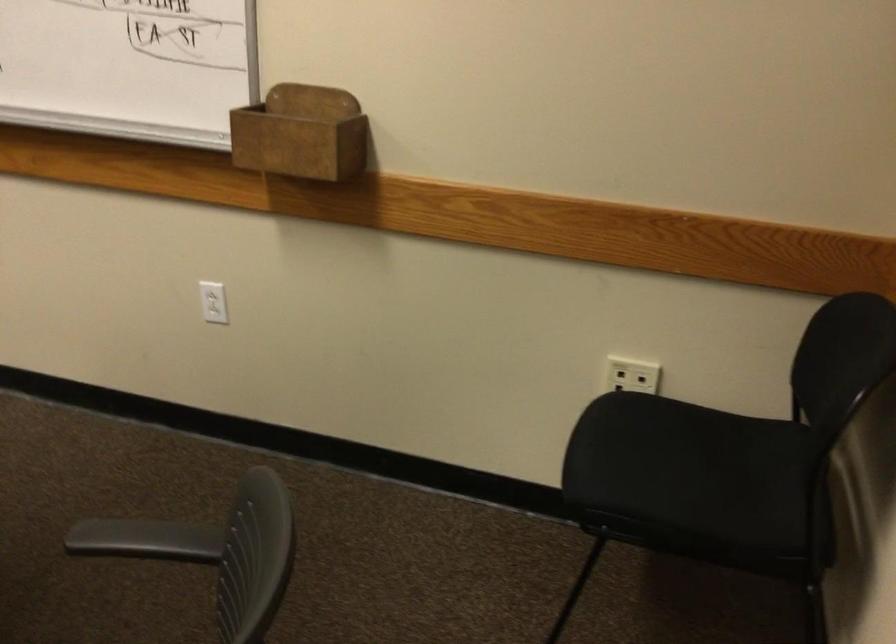
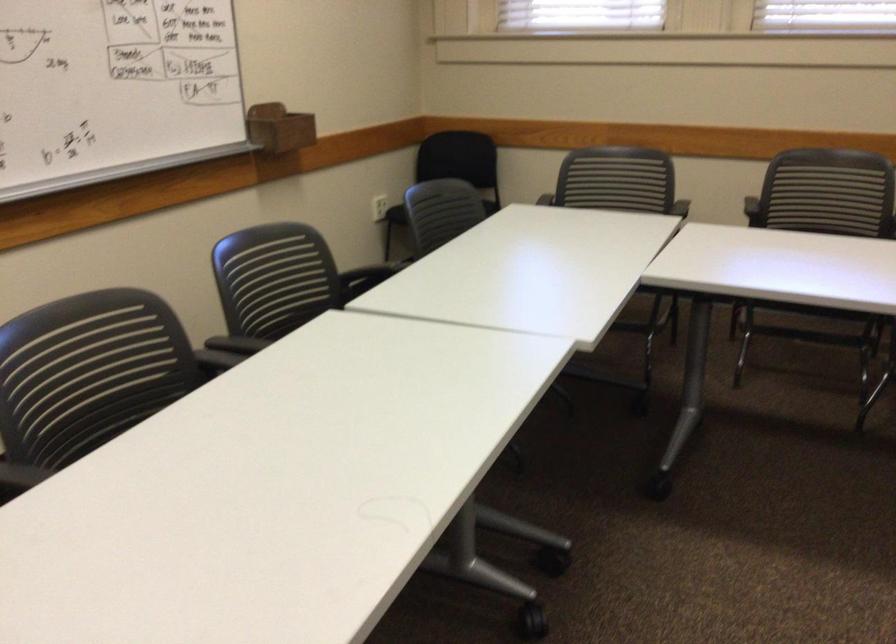
Where in the second image is the point corresponding to [263,117] from the first image?

(279, 128)